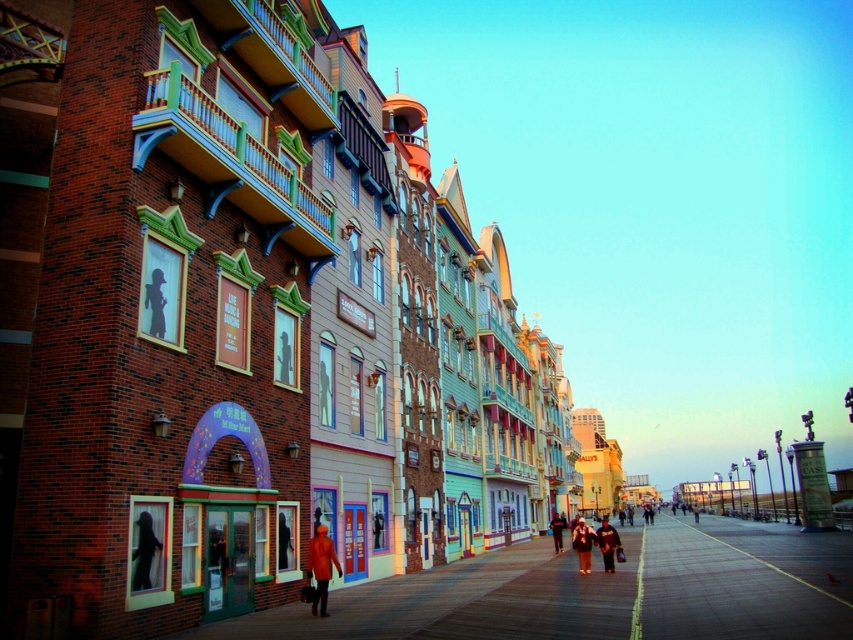
From the picture: You are a tailor who needs to determine which piece of orange fabric is suitable for a customer who requires a longer garment. The customer is looking at the orange fabric coat at center and orange fabric jacket at center displayed in the scene. Which one should you recommend?

The orange fabric coat at center is much taller than the orange fabric jacket at center, so you should recommend the orange fabric coat at center for the customer who needs a longer garment.

You are standing on the boardwalk and see the orange fabric coat at center. If you walk straight ahead, will you encounter the coat before reaching the end of the boardwalk?

The orange fabric coat at center is located at point (582,545), which is closer to the end of the boardwalk than your current position. Therefore, you will reach the end of the boardwalk before encountering the coat.